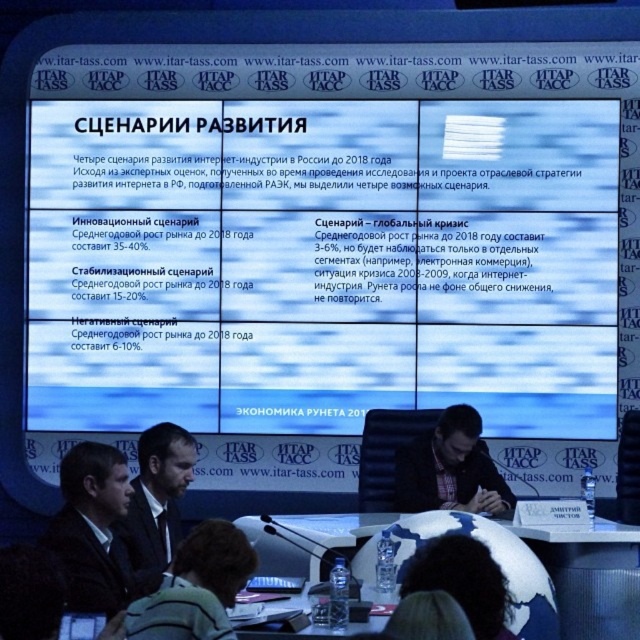
You are an attendee sitting in the front row of the conference hall. You want to place a 2.5 meter long banner on the floor between you and the white glossy table at center. Is there enough space to lay it out fully without folding?

The white glossy table at center is 7.58 meters away from the viewer. Since the banner is 2.5 meters long, there is sufficient space to lay it out fully without folding as the distance is greater than the banner length.

You are a photographer taking a picture of the conference panel. You notice two points of interest marked as point 1 at coordinate (611, 552) and point 2 at coordinate (86, 486). Which point is closer to your camera lens?

Point 2 at coordinate (86, 486) is closer to the camera lens because it is positioned nearer to the viewer compared to point 1 at coordinate (611, 552).